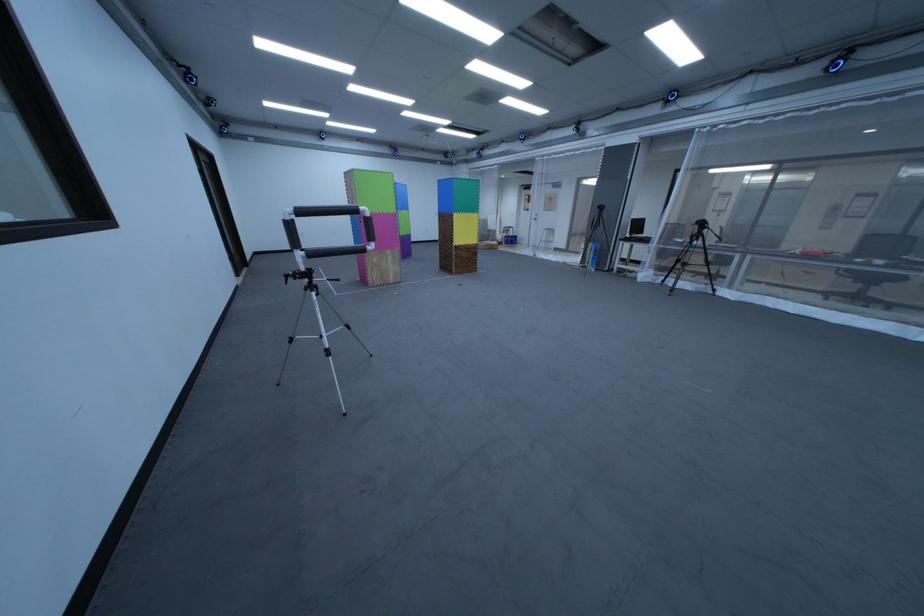
You are a GUI agent. You are given a task and a screenshot of the screen. Output one action in this format:
    pyautogui.click(x=<x>, y=<y>)
    Task: Click on the blue foam block
    
    Given the screenshot: What is the action you would take?
    pyautogui.click(x=450, y=195)